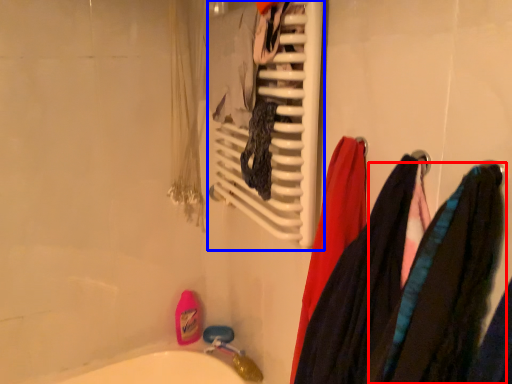
Question: Which point is further to the camera, clothing (highlighted by a red box) or towel rack (highlighted by a blue box)?

Choices:
 (A) clothing
 (B) towel rack

Answer: (B)